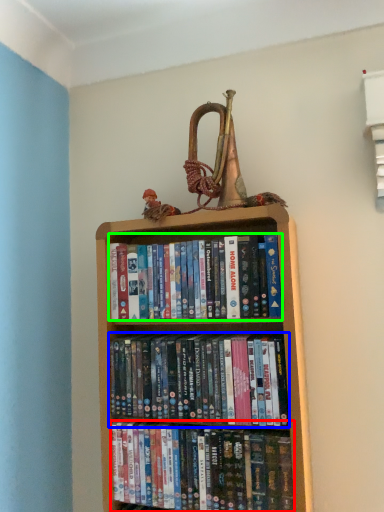
Question: Considering the real-world distances, which object is farthest from book (highlighted by a red box)? book (highlighted by a blue box) or book (highlighted by a green box)?

Choices:
 (A) book
 (B) book

Answer: (B)